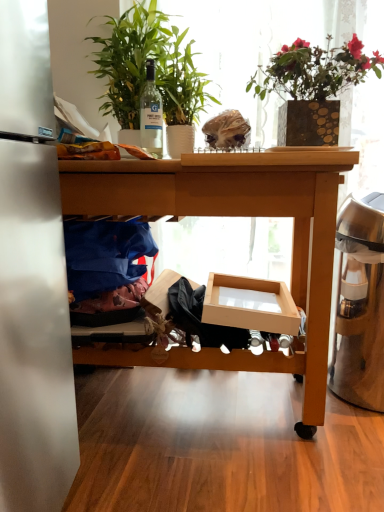
Identify the location of vacant region in front of satin silver trash can at right. The height and width of the screenshot is (512, 384). (347, 444).